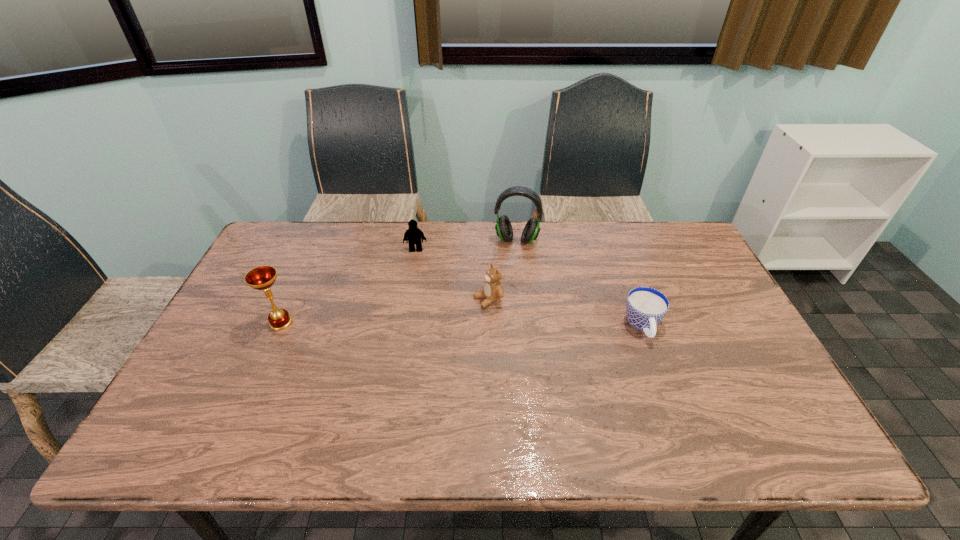
Image resolution: width=960 pixels, height=540 pixels. Find the location of `free space at the far edge of the desktop`. free space at the far edge of the desktop is located at coordinates (323, 239).

Identify the location of free space at the near edge of the desktop. (397, 409).

Image resolution: width=960 pixels, height=540 pixels. Identify the location of vacant space at the left edge of the desktop. (245, 353).

You are a GUI agent. You are given a task and a screenshot of the screen. Output one action in this format:
    pyautogui.click(x=<x>, y=<y>)
    Task: Click on the vacant space at the right edge
    The width and height of the screenshot is (960, 540).
    Given the screenshot: What is the action you would take?
    pyautogui.click(x=764, y=363)

The height and width of the screenshot is (540, 960). In the image, there is a desktop. What are the coordinates of `vacant space at the near right corner` in the screenshot? It's located at (733, 402).

Find the location of a particular element. The height and width of the screenshot is (540, 960). vacant space that's between the shortest object and the fourth object from right to left is located at coordinates (529, 288).

The width and height of the screenshot is (960, 540). What are the coordinates of `free area in between the teddy bear and the second object from left to right` in the screenshot? It's located at (452, 274).

Locate an element on the screen. This screenshot has width=960, height=540. blank region between the chalice and the shortest object is located at coordinates (462, 325).

Where is `free point between the chalice and the shortest object`? free point between the chalice and the shortest object is located at coordinates (462, 325).

I want to click on vacant region between the teddy bear and the Lego, so click(452, 274).